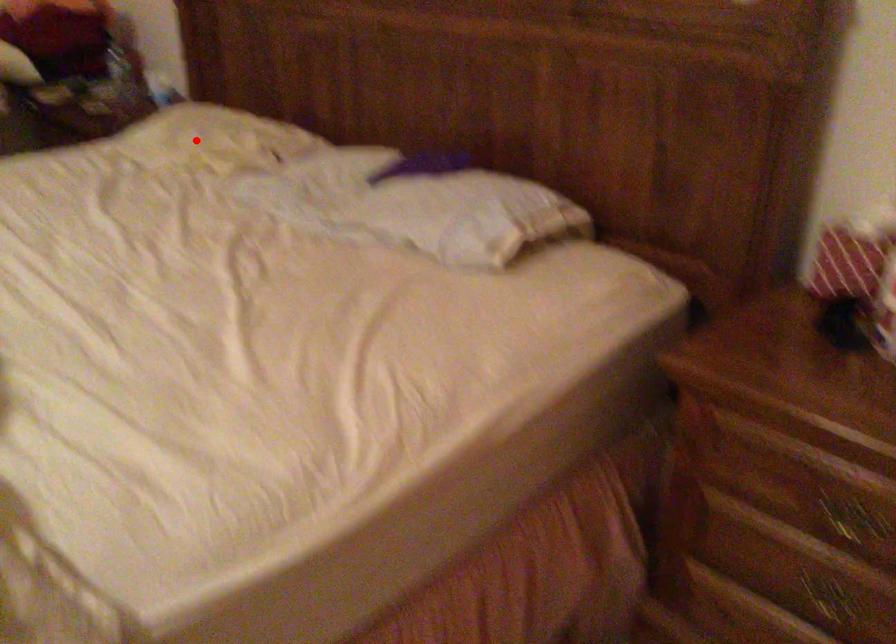
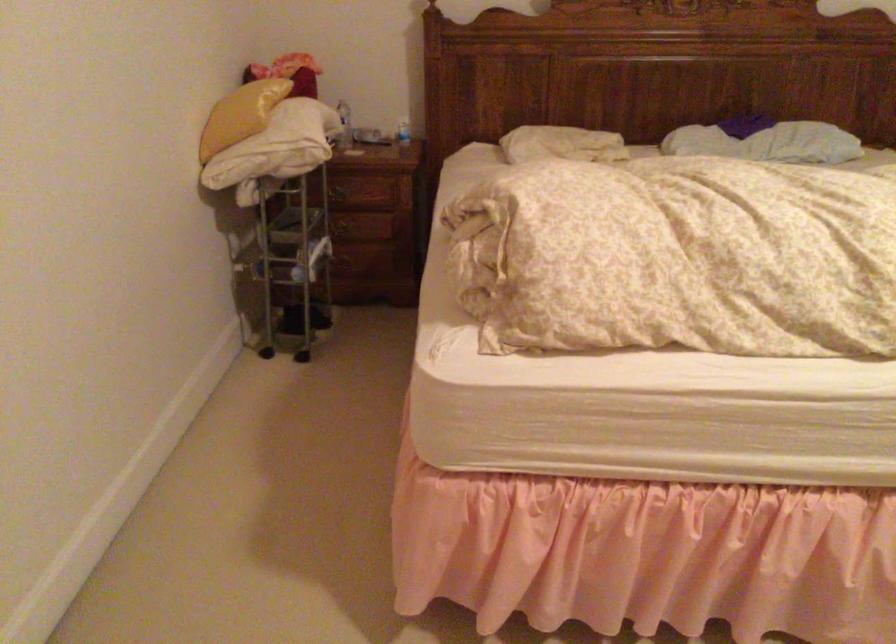
Question: I am providing you with two images of the same scene from different viewpoints. In image1, a red point is highlighted. Considering the same 3D point in image2, which of the following is correct?

Choices:
 (A) It is closer
 (B) It is farther

Answer: (B)